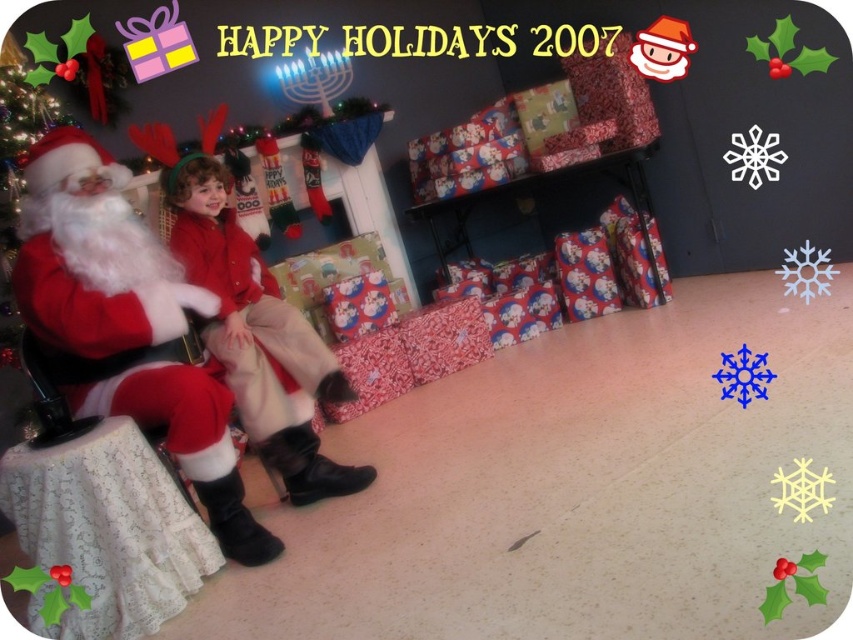
Which of these two, red velvet santa at left or red velvet coat at center, stands taller?

With more height is red velvet santa at left.

Is the position of red velvet santa at left less distant than that of red velvet coat at center?

Yes.

Which is behind, point (209, 461) or point (186, 237)?

Positioned behind is point (186, 237).

This screenshot has height=640, width=853. In order to click on red velvet santa at left in this screenshot , I will do `click(125, 324)`.